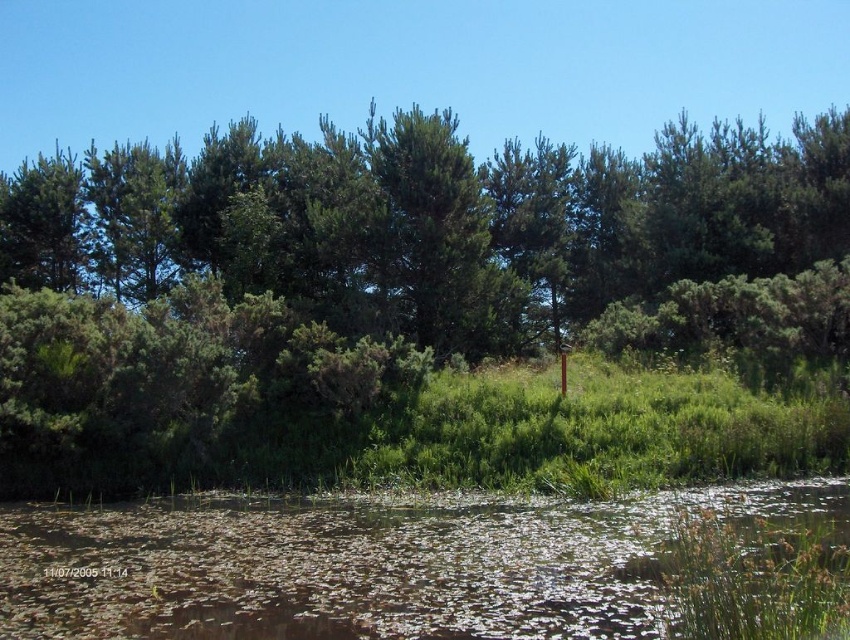
Does green leafy tree at center appear on the right side of translucent murky water at lower center?

Incorrect, green leafy tree at center is not on the right side of translucent murky water at lower center.

Which is above, green leafy tree at center or translucent murky water at lower center?

green leafy tree at center is above.

Which is in front, point (242, 332) or point (518, 541)?

Positioned in front is point (518, 541).

Locate an element on the screen. green leafy tree at center is located at coordinates pyautogui.click(x=411, y=304).